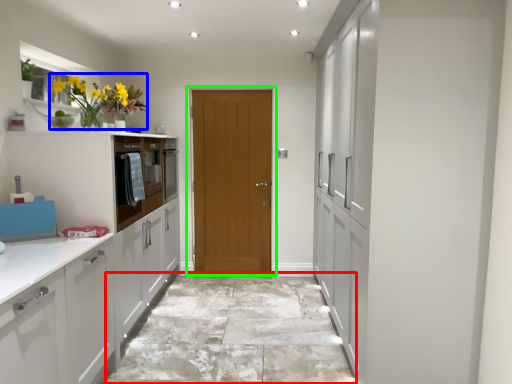
Question: Based on their relative distances, which object is nearer to granite (highlighted by a red box)? Choose from floral arrangement (highlighted by a blue box) and door (highlighted by a green box).

Choices:
 (A) floral arrangement
 (B) door

Answer: (B)